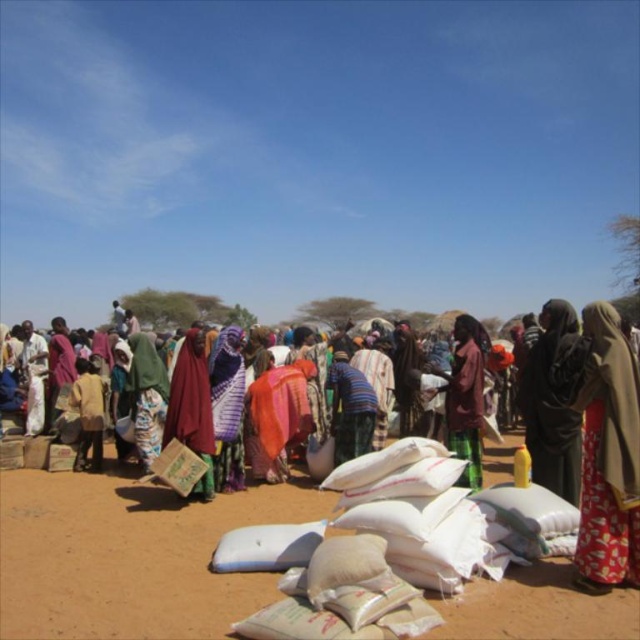
Question: Which is nearer to the dark brown fabric headscarf at center?

Choices:
 (A) white fabric bags at center
 (B) brown sandbags at center

Answer: (A)

Question: Which object appears closest to the camera in this image?

Choices:
 (A) matte purple scarf at center
 (B) dark brown fabric headscarf at center

Answer: (A)

Question: Which point is farther to the camera?

Choices:
 (A) (564, 490)
 (B) (588, 416)
 (C) (580, 474)

Answer: (C)

Question: Is white fabric bags at center in front of matte purple scarf at center?

Choices:
 (A) yes
 (B) no

Answer: (A)

Question: Does dark brown fabric headscarf at center appear under matte purple scarf at center?

Choices:
 (A) no
 (B) yes

Answer: (B)

Question: Does brown sandbags at center have a lesser width compared to white fabric bags at center?

Choices:
 (A) yes
 (B) no

Answer: (B)